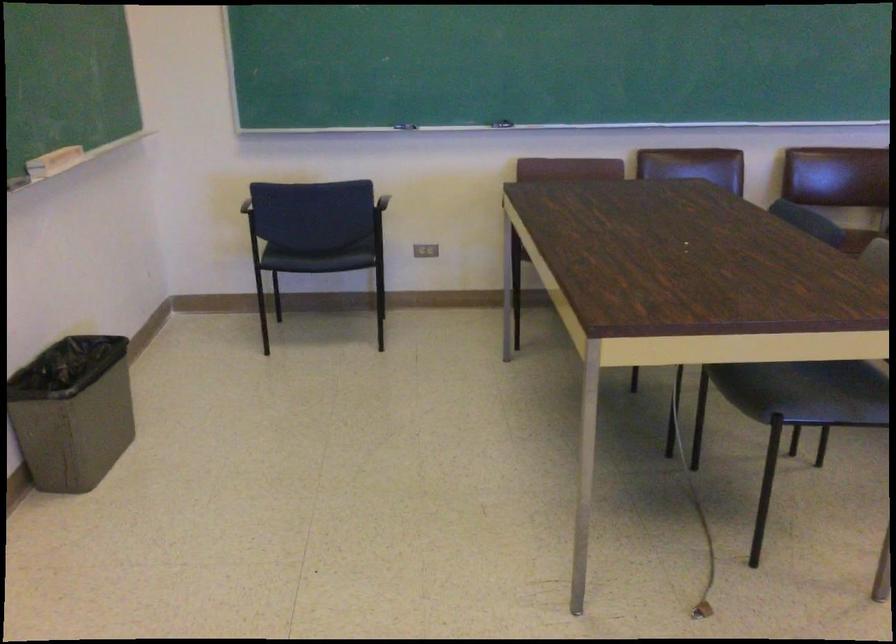
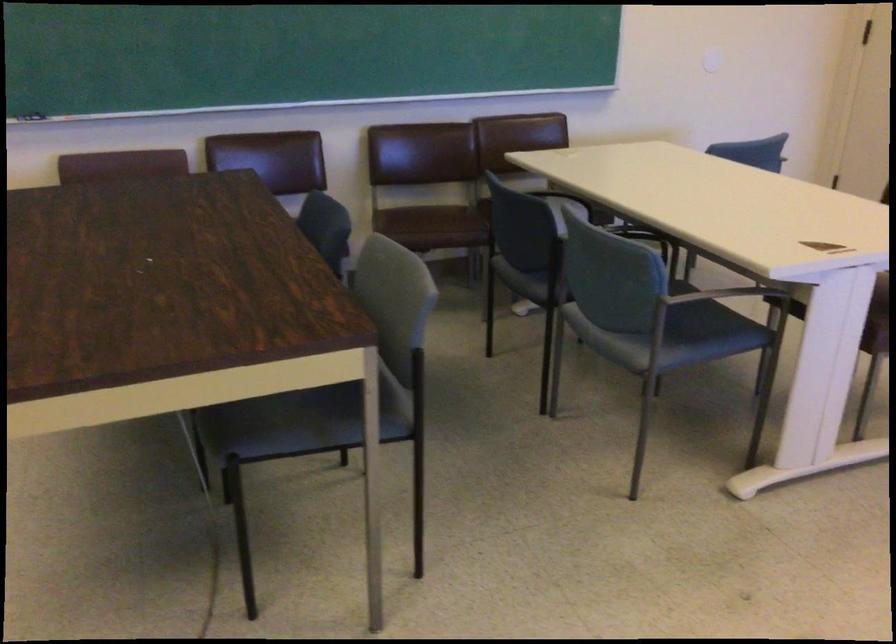
Where in the second image is the point corresponding to the point at 791,390 from the first image?

(282, 424)